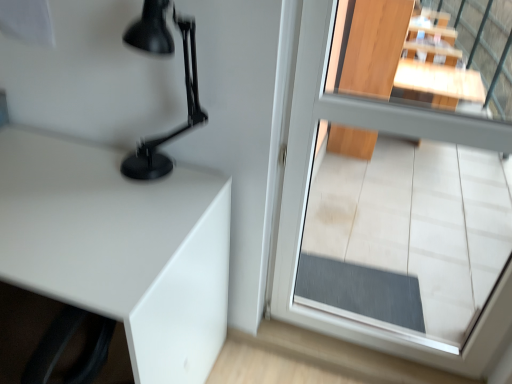
At what (x,y) coordinates should I click in order to perform the action: click on vacant area that is in front of matte black lamp at upper left. Please return your answer as a coordinate pair (x, y). This screenshot has width=512, height=384. Looking at the image, I should click on (136, 221).